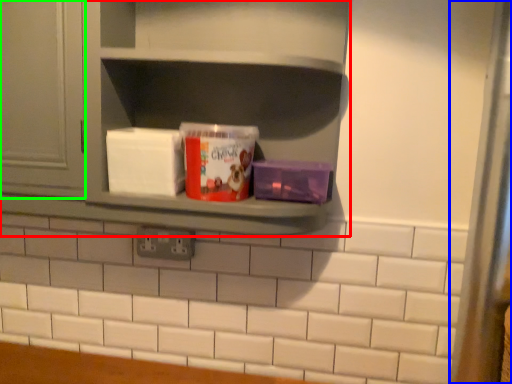
Question: Estimate the real-world distances between objects in this image. Which object is farther from shelf (highlighted by a red box), glass door (highlighted by a blue box) or window (highlighted by a green box)?

Choices:
 (A) glass door
 (B) window

Answer: (A)